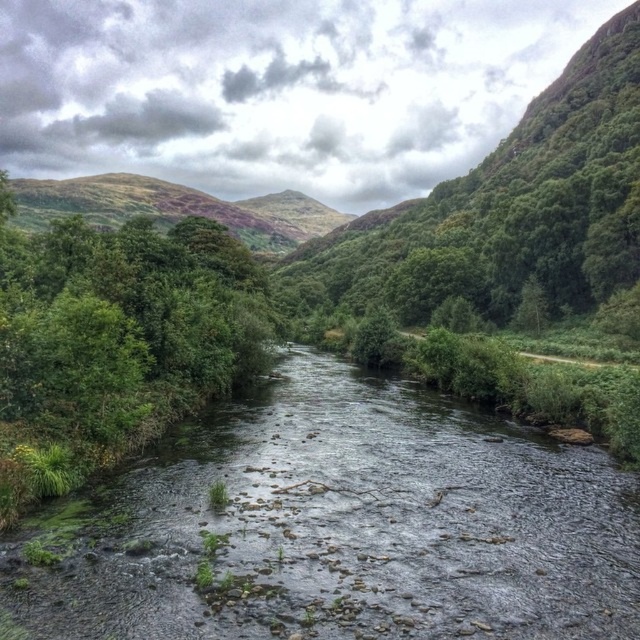
Question: Which point appears farthest from the camera in this image?

Choices:
 (A) (349, 385)
 (B) (109, 195)

Answer: (B)

Question: Where is clear water at center located in relation to green mossy hillside at center in the image?

Choices:
 (A) below
 (B) above

Answer: (A)

Question: Is clear water at center below green mossy hillside at center?

Choices:
 (A) no
 (B) yes

Answer: (B)

Question: Which object appears farthest from the camera in this image?

Choices:
 (A) green mossy hillside at center
 (B) clear water at center

Answer: (A)

Question: Is clear water at center further to the viewer compared to green mossy hillside at center?

Choices:
 (A) no
 (B) yes

Answer: (A)